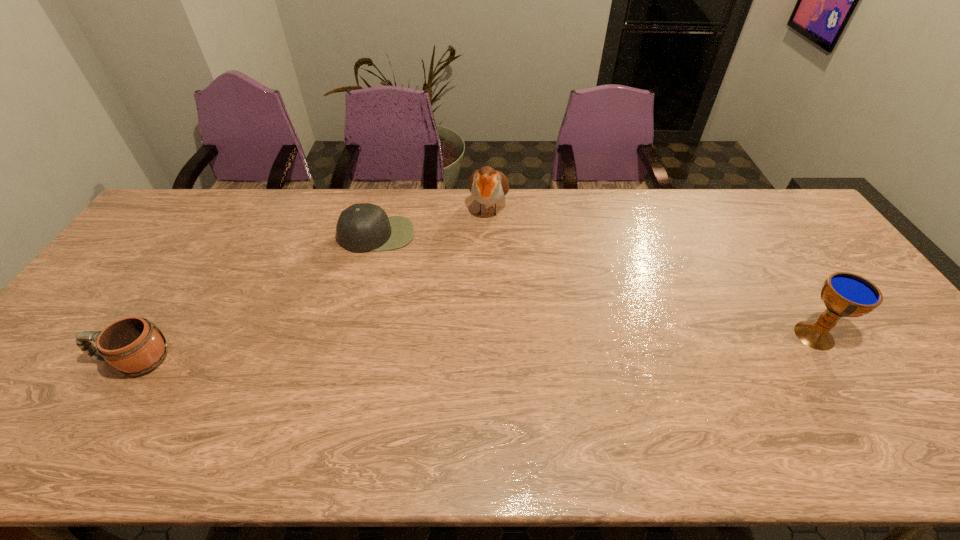
I want to click on free space on the desktop that is between the leftmost object and the chalice and is positioned at the face of the third object from left to right, so click(x=459, y=348).

You are a GUI agent. You are given a task and a screenshot of the screen. Output one action in this format:
    pyautogui.click(x=<x>, y=<y>)
    Task: Click on the vacant space on the desktop that is between the leftmost object and the chalice and is positioned on the brim of the cap
    This screenshot has height=540, width=960.
    Given the screenshot: What is the action you would take?
    pyautogui.click(x=384, y=351)